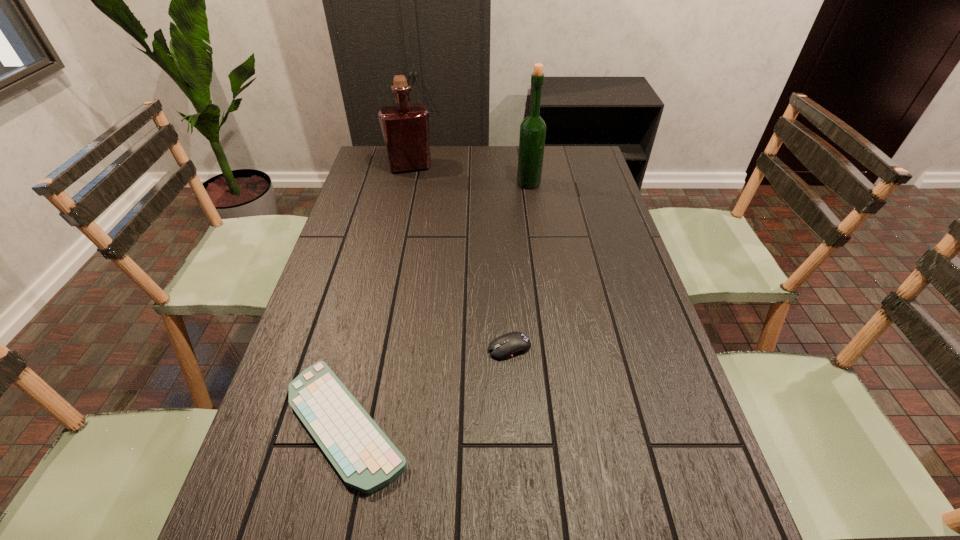
You are a GUI agent. You are given a task and a screenshot of the screen. Output one action in this format:
    pyautogui.click(x=<x>, y=<y>)
    Task: Click on the closest object to the computer equipment
    This screenshot has width=960, height=540.
    Given the screenshot: What is the action you would take?
    pyautogui.click(x=364, y=457)

Find the location of `the closest object to the second shortest object`. the closest object to the second shortest object is located at coordinates (364, 457).

This screenshot has height=540, width=960. In order to click on free spot that satisfies the following two spatial constraints: 1. on the front side of the third nearest object; 2. on the left side of the shorter liquor in this screenshot , I will do `click(406, 184)`.

Find the location of a particular element. This screenshot has width=960, height=540. vacant space that satisfies the following two spatial constraints: 1. on the front side of the left liquor; 2. on the left side of the nearer liquor is located at coordinates (406, 184).